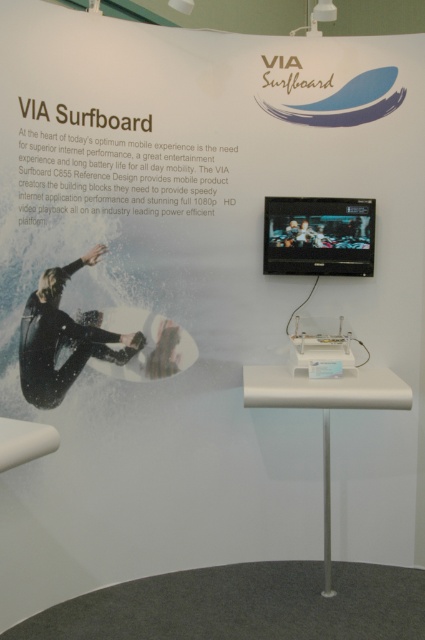
Between point (40, 288) and point (144, 310), which one is positioned behind?

The point (144, 310) is behind.

In order to click on black matte surfboard at center in this screenshot , I will do `click(62, 337)`.

Between point (31, 387) and point (159, 349), which one is positioned in front?

Point (31, 387) is more forward.

This screenshot has width=425, height=640. What are the coordinates of `black matte surfboard at center` in the screenshot? It's located at (62, 337).